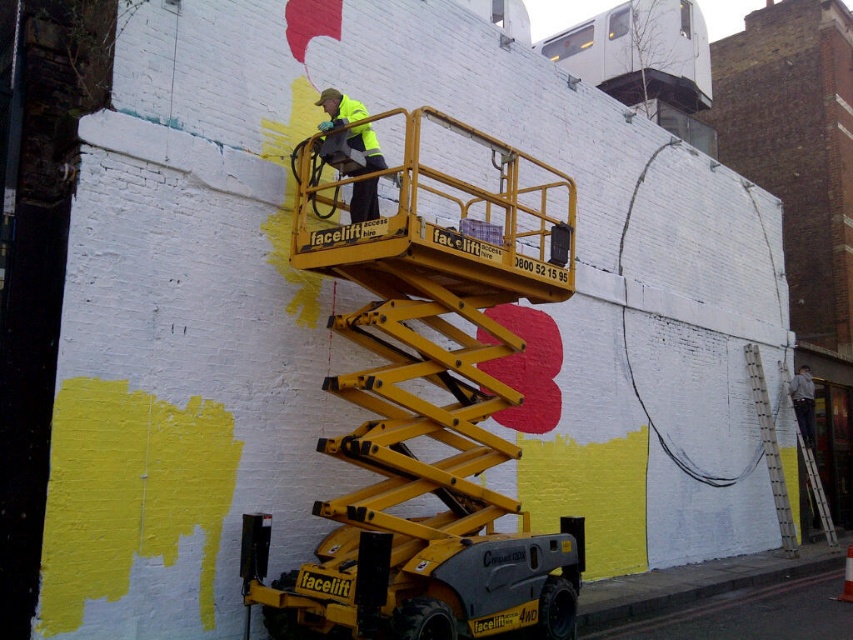
Question: Which object appears closest to the camera in this image?

Choices:
 (A) white plastic ladder at right
 (B) yellow metallic scissor lift at center

Answer: (B)

Question: Considering the real-world distances, which object is closest to the white plastic ladder at right?

Choices:
 (A) high visibility yellow jacket at center
 (B) yellow metallic scissor lift at center

Answer: (B)

Question: Can you confirm if yellow metallic scissor lift at center is positioned to the right of white plastic ladder at right?

Choices:
 (A) yes
 (B) no

Answer: (B)

Question: Which object is the farthest from the yellow metallic scissor lift at center?

Choices:
 (A) white plastic ladder at right
 (B) high visibility yellow jacket at center

Answer: (A)

Question: Is yellow metallic scissor lift at center above white plastic ladder at right?

Choices:
 (A) no
 (B) yes

Answer: (B)

Question: Is yellow metallic scissor lift at center positioned at the back of white plastic ladder at right?

Choices:
 (A) yes
 (B) no

Answer: (B)